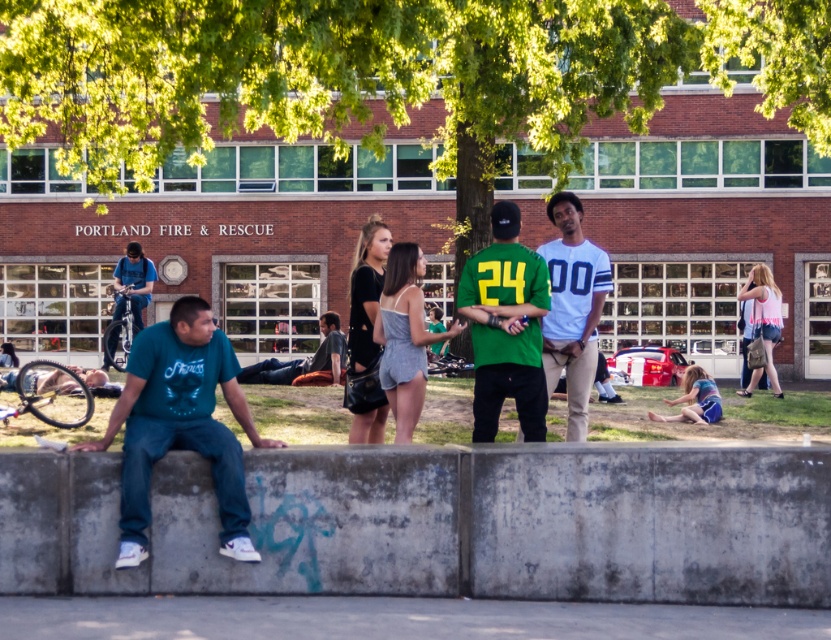
You are a photographer trying to capture a shot of the green leafy tree at upper center and the denim shorts at center. Based on their sizes in the image, which object appears taller?

The green leafy tree at upper center appears taller than the denim shorts at center because it has a greater height compared to the denim shorts at center.